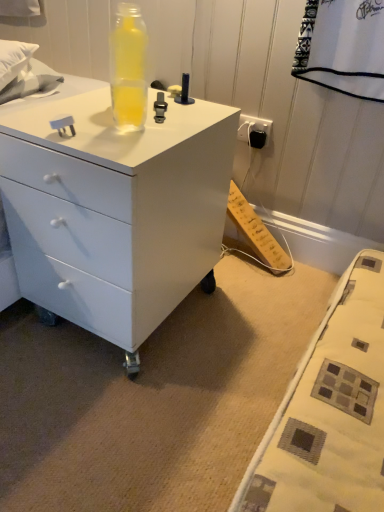
Where is `free space to the left of transparent plastic bottle at upper center`? free space to the left of transparent plastic bottle at upper center is located at coordinates (74, 114).